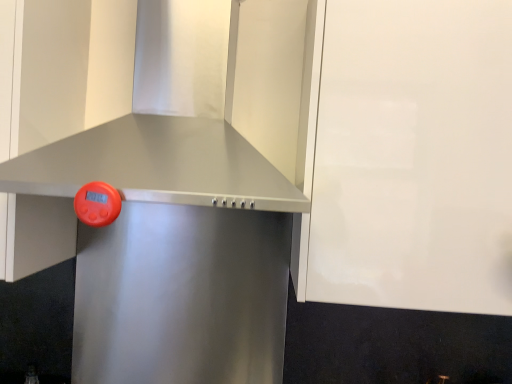
Question: Based on their sizes in the image, would you say satin metallic range hood at center is bigger or smaller than white glossy cabinet at upper right?

Choices:
 (A) big
 (B) small

Answer: (B)

Question: Would you say satin metallic range hood at center is to the left or to the right of white glossy cabinet at upper right in the picture?

Choices:
 (A) left
 (B) right

Answer: (A)

Question: Estimate the real-world distances between objects in this image. Which object is farther from the satin metallic vent at center?

Choices:
 (A) satin metallic range hood at center
 (B) white glossy cabinet at upper right

Answer: (A)

Question: Considering the real-world distances, which object is farthest from the satin metallic range hood at center?

Choices:
 (A) satin metallic vent at center
 (B) white glossy cabinet at upper right

Answer: (B)